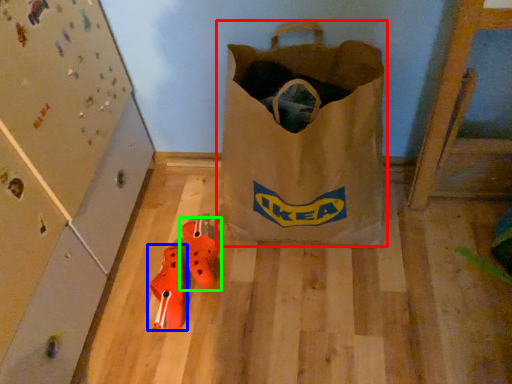
Question: Which is farther away from luggage and bags (highlighted by a red box)? footwear (highlighted by a blue box) or footwear (highlighted by a green box)?

Choices:
 (A) footwear
 (B) footwear

Answer: (A)